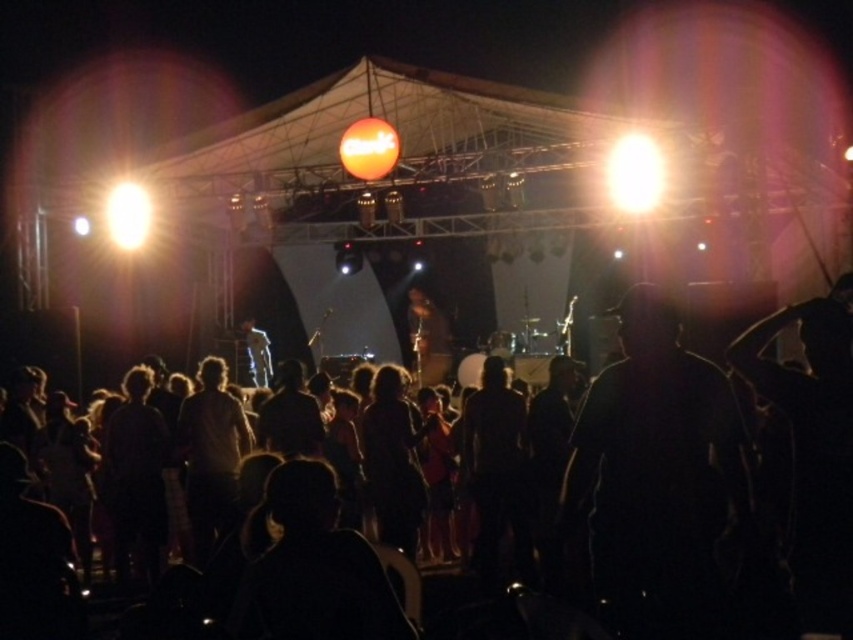
You are a photographer at the concert, and you want to capture the stage lights. Which object, the bright white light at upper right or the bright white bulb at left, is positioned to the right side of the other?

The bright white light at upper right is positioned to the right of the bright white bulb at left.

You are a photographer at the concert. You want to capture a photo of the black matte person at center and the light blue denim jacket at center. Which object should you focus on first if you want to ensure both are in focus?

The black matte person at center should be focused on first since it has a greater height compared to the light blue denim jacket at center, ensuring depth of field covers both.

You are a photographer at the concert and want to capture the brightest light source in the scene. Which one should you focus on between the bright white light at upper right and the bright white bulb at left?

The bright white light at upper right is bigger than the bright white bulb at left, so it is the brighter light source and should be focused on.